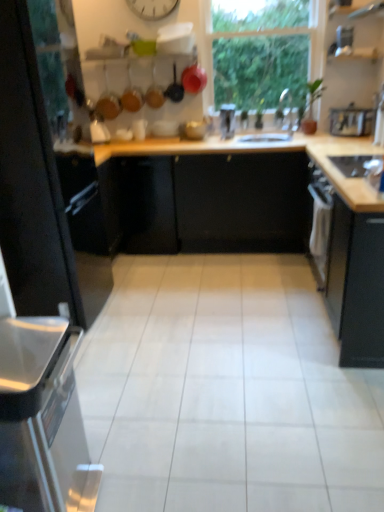
Locate an element on the screen. This screenshot has width=384, height=512. free space above black glass stove at right, which is counted as the fifth appliance, starting from the top (from a real-world perspective) is located at coordinates (359, 160).